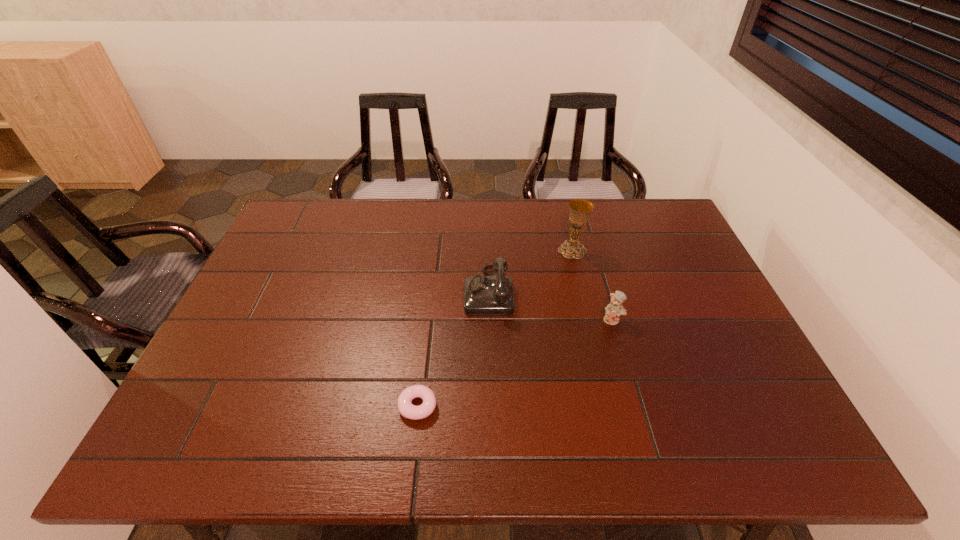
Where is `free space located 0.280m on the front-facing side of the teddy bear`? This screenshot has height=540, width=960. free space located 0.280m on the front-facing side of the teddy bear is located at coordinates (642, 423).

Find the location of a particular element. The width and height of the screenshot is (960, 540). vacant region located on the right of the leftmost object is located at coordinates (508, 406).

Where is `object at the near edge`? object at the near edge is located at coordinates (405, 407).

Locate an element on the screen. This screenshot has width=960, height=540. blank space at the far edge of the desktop is located at coordinates (501, 216).

This screenshot has height=540, width=960. In order to click on free location at the near edge in this screenshot , I will do `click(277, 457)`.

The image size is (960, 540). In the image, there is a desktop. Identify the location of vacant region at the left edge. (270, 258).

In order to click on vacant space at the right edge of the desktop in this screenshot , I will do `click(686, 276)`.

The image size is (960, 540). Find the location of `free space at the far left corner`. free space at the far left corner is located at coordinates (301, 203).

The height and width of the screenshot is (540, 960). I want to click on free spot at the near left corner of the desktop, so click(x=188, y=432).

Where is `empty space that is in between the teddy bear and the shortest object`? empty space that is in between the teddy bear and the shortest object is located at coordinates pos(516,363).